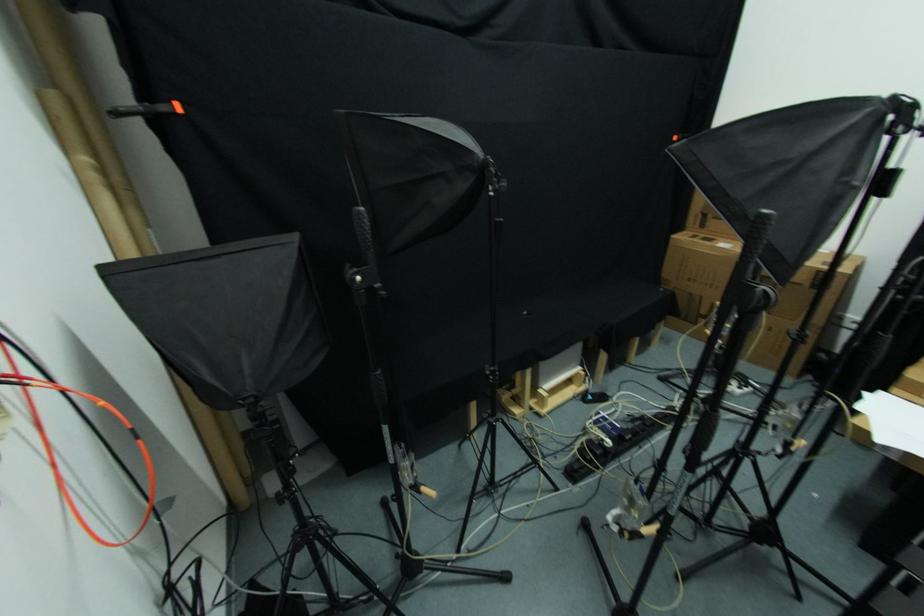
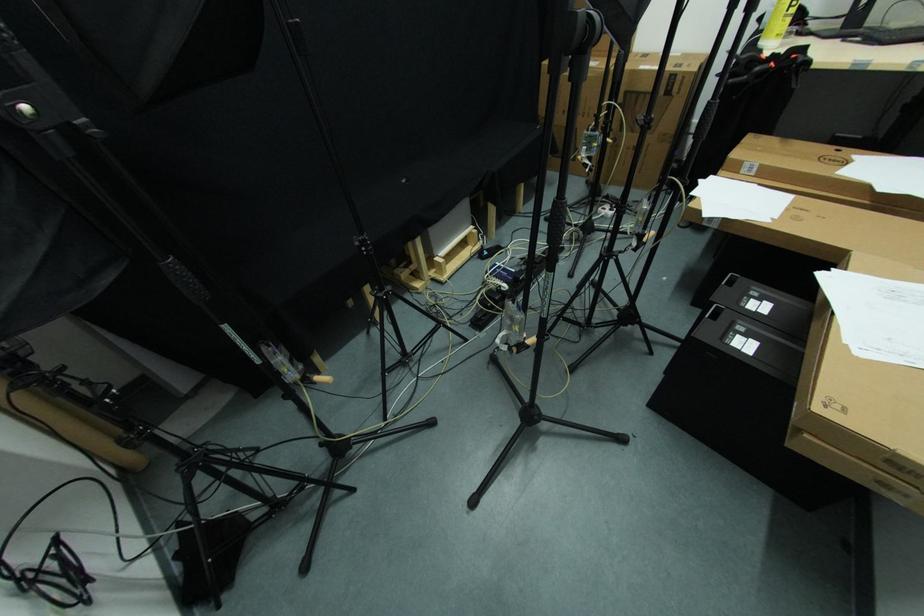
Question: The first image is from the beginning of the video and the second image is from the end. How did the camera likely rotate when shooting the video?

Choices:
 (A) Left
 (B) Right
 (C) Up
 (D) Down

Answer: (D)